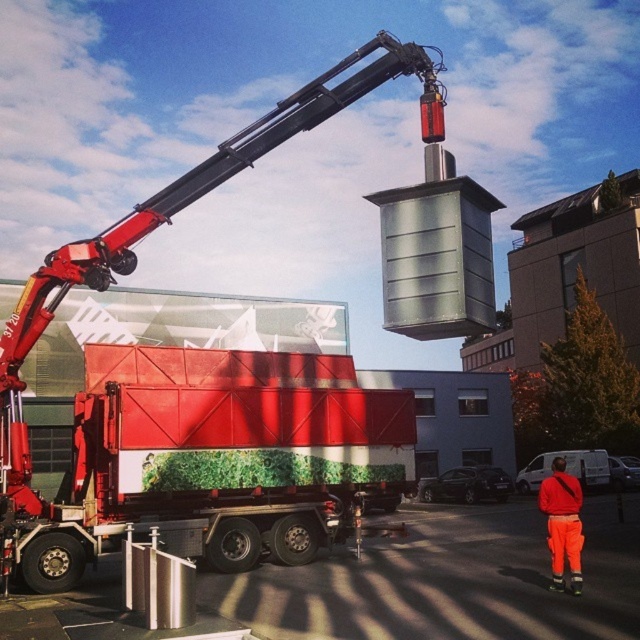
Which is above, red matte trailer truck at center or orange reflective pants at lower right?

red matte trailer truck at center is above.

Between point (292, 499) and point (540, 496), which one is positioned behind?

Point (292, 499)

Where is `red matte trailer truck at center`? Image resolution: width=640 pixels, height=640 pixels. red matte trailer truck at center is located at coordinates (205, 458).